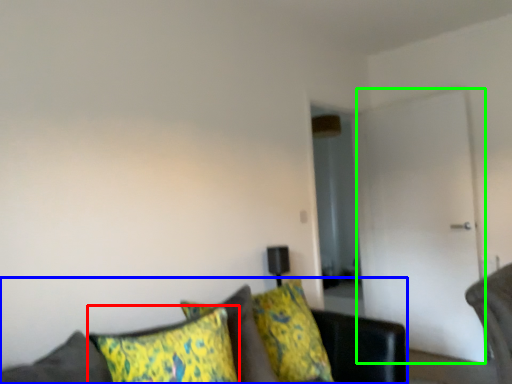
Question: Which is farther away from pillow (highlighted by a red box)? studio couch (highlighted by a blue box) or glass door (highlighted by a green box)?

Choices:
 (A) studio couch
 (B) glass door

Answer: (B)